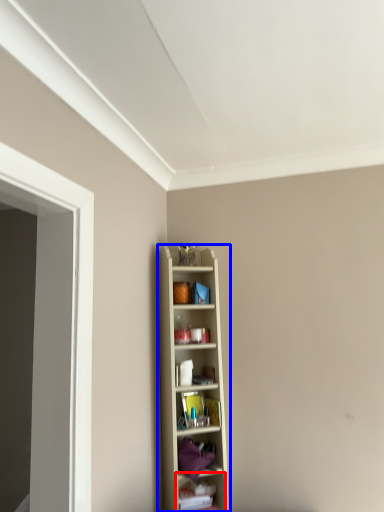
Question: Among these objects, which one is farthest to the camera, shelf (highlighted by a red box) or shelf (highlighted by a blue box)?

Choices:
 (A) shelf
 (B) shelf

Answer: (A)